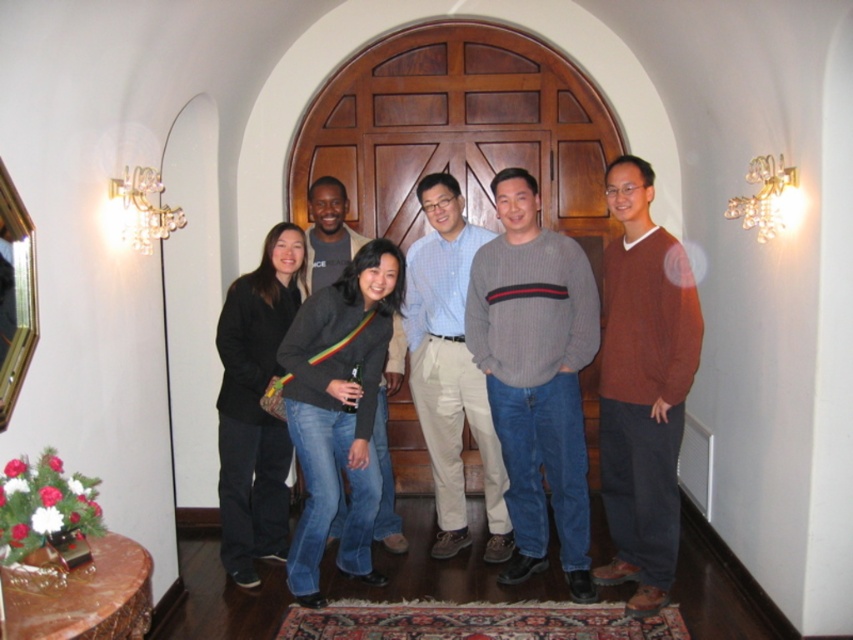
Question: From the image, what is the correct spatial relationship of gray ribbed sweater at center in relation to dark gray sweater at center?

Choices:
 (A) left
 (B) right

Answer: (B)

Question: Can you confirm if gray sweater at center is positioned below dark gray sweater at center?

Choices:
 (A) yes
 (B) no

Answer: (B)

Question: Which object is positioned farthest from the gray ribbed sweater at center?

Choices:
 (A) dark gray sweater at center
 (B) matte brown sweater at right
 (C) gray sweater at center

Answer: (A)

Question: Which object is positioned farthest from the matte brown sweater at right?

Choices:
 (A) gray ribbed sweater at center
 (B) gray sweater at center
 (C) dark gray sweater at center

Answer: (C)

Question: Is matte brown sweater at right to the left of dark gray sweater at center from the viewer's perspective?

Choices:
 (A) no
 (B) yes

Answer: (A)

Question: Which point appears closest to the camera in this image?

Choices:
 (A) (335, 234)
 (B) (633, 557)
 (C) (451, 470)
 (D) (529, 292)

Answer: (D)